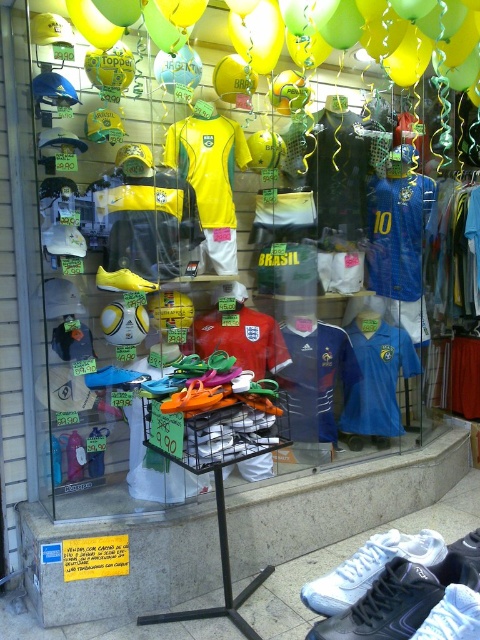
Question: Does yellow glossy balloon at upper center appear under yellow matte soccer shoe at center?

Choices:
 (A) no
 (B) yes

Answer: (A)

Question: From the image, what is the correct spatial relationship of yellow glossy balloon at upper center in relation to white synthetic shoe at lower right?

Choices:
 (A) left
 (B) right

Answer: (A)

Question: Among these objects, which one is farthest from the camera?

Choices:
 (A) white synthetic shoe at lower right
 (B) white mesh shoe at lower right
 (C) yellow glossy balloon at upper center
 (D) yellow matte soccer shoe at center

Answer: (D)

Question: Which point appears closest to the camera in this image?

Choices:
 (A) (312, 61)
 (B) (416, 532)

Answer: (A)

Question: Is white synthetic shoe at lower right bigger than yellow matte soccer shoe at center?

Choices:
 (A) yes
 (B) no

Answer: (B)

Question: Among these objects, which one is nearest to the camera?

Choices:
 (A) yellow glossy balloon at upper center
 (B) white synthetic shoe at lower right
 (C) yellow matte soccer shoe at center

Answer: (B)